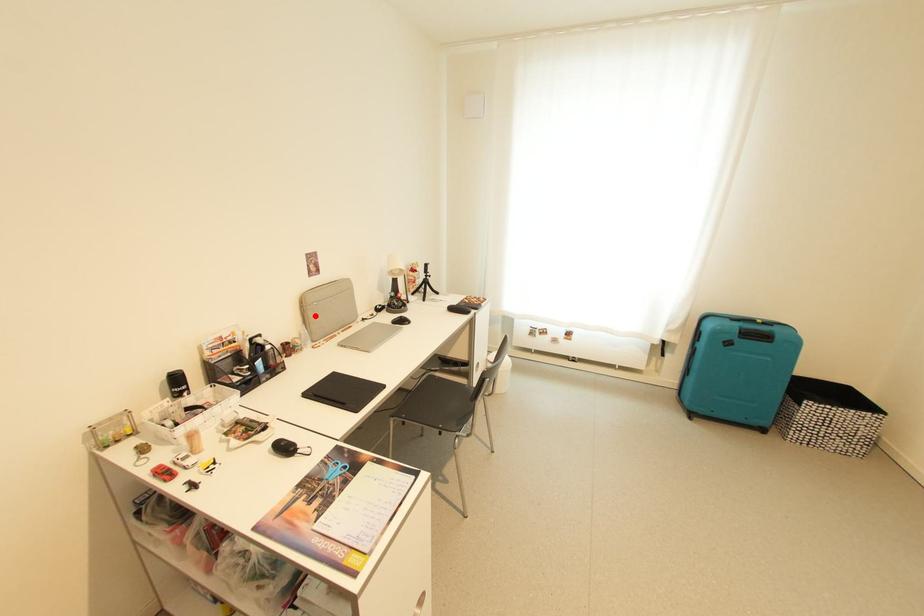
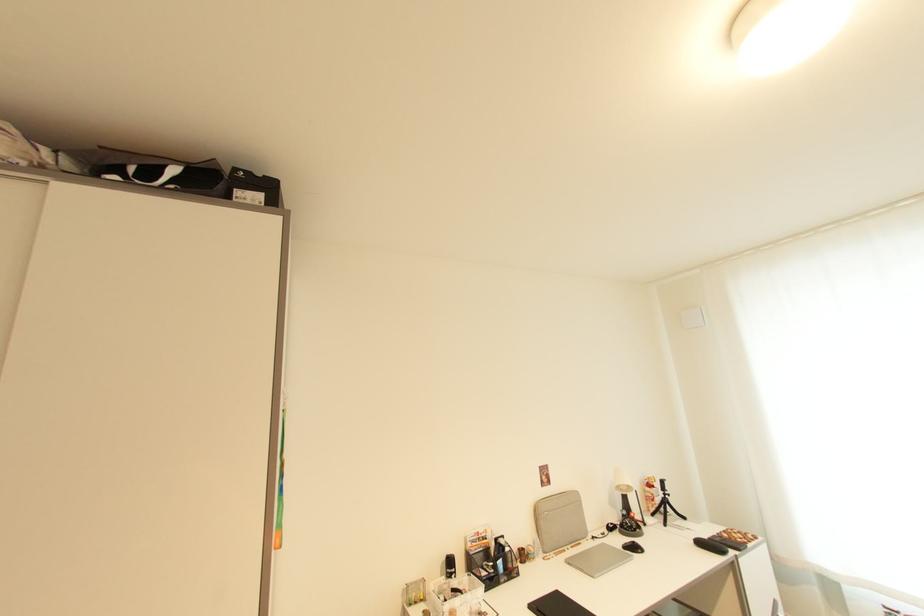
Where in the second image is the point corresponding to the highlighted location from the first image?

(546, 525)